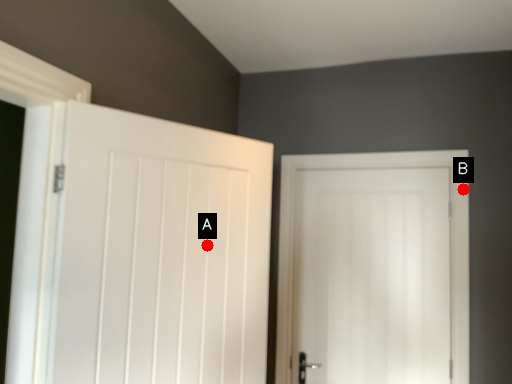
Question: Two points are circled on the image, labeled by A and B beside each circle. Which point is farther to the camera?

Choices:
 (A) A is further
 (B) B is further

Answer: (B)